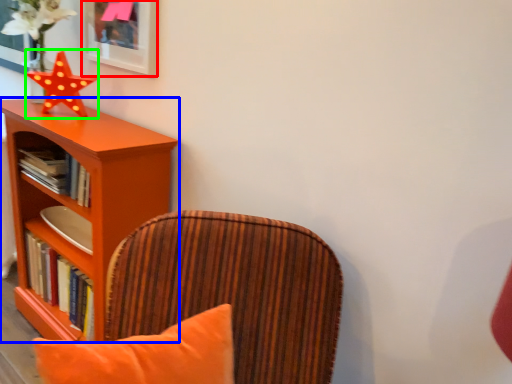
Question: Based on their relative distances, which object is nearer to picture frame (highlighted by a red box)? Choose from shelf (highlighted by a blue box) and star (highlighted by a green box).

Choices:
 (A) shelf
 (B) star

Answer: (B)